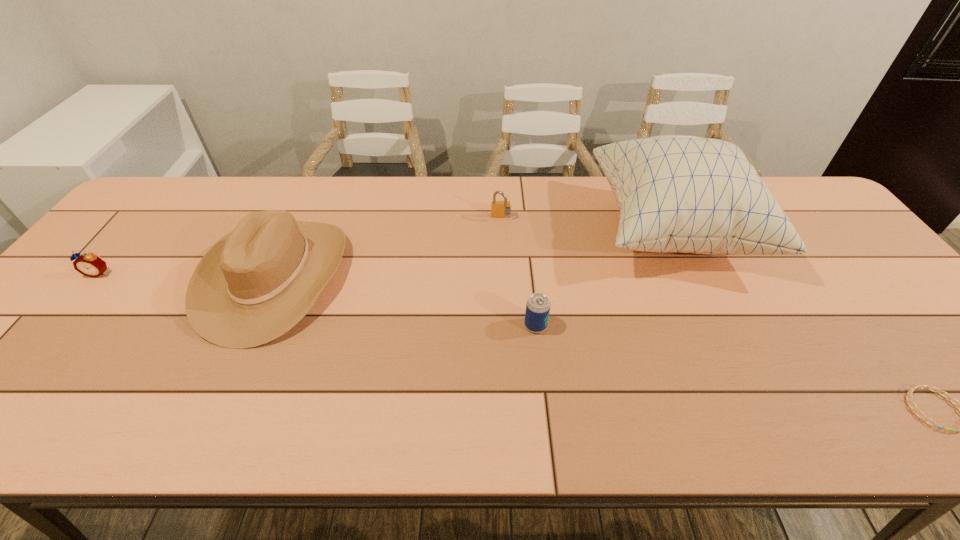
Identify the location of vacant region that satisfies the following two spatial constraints: 1. on the side with the combination dials of the fourth object from left to right; 2. on the left side of the padlock. This screenshot has height=540, width=960. (507, 326).